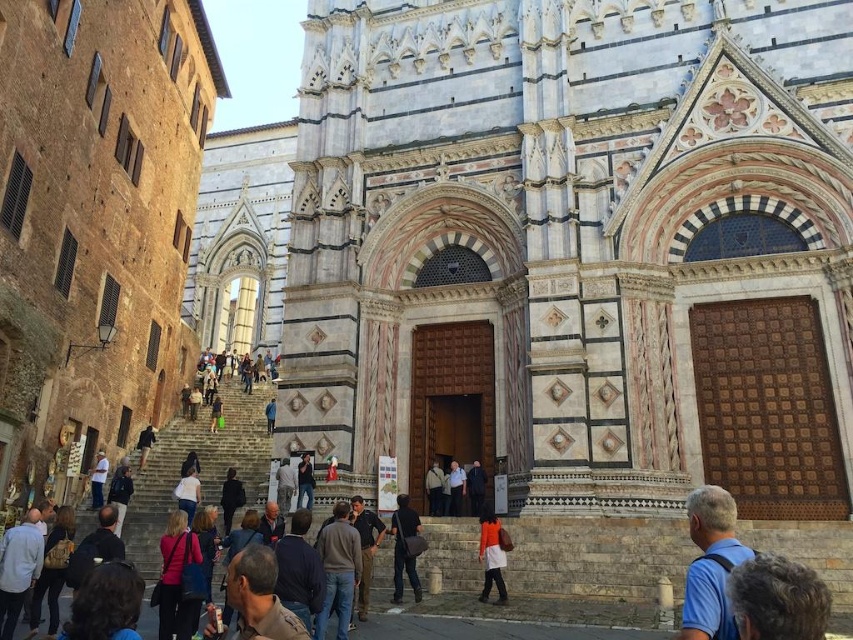
Who is lower down, gray stone stairs at center or brown leather jacket at center?

gray stone stairs at center

Which is more to the left, gray stone stairs at center or brown leather jacket at center?

From the viewer's perspective, gray stone stairs at center appears more on the left side.

At what (x,y) coordinates should I click in order to perform the action: click on gray stone stairs at center. Please return your answer as a coordinate pair (x, y). The width and height of the screenshot is (853, 640). Looking at the image, I should click on (200, 465).

Can you confirm if brown leather jacket at center is positioned above dark brown leather backpack at center?

Yes, brown leather jacket at center is above dark brown leather backpack at center.

Is point (337, 529) closer to camera compared to point (401, 518)?

Yes, point (337, 529) is in front of point (401, 518).

Find the location of `brown leather jacket at center`. brown leather jacket at center is located at coordinates (337, 570).

Consider the image. Does gray stone stairs at center have a greater height compared to light brown leather backpack at lower left?

Indeed, gray stone stairs at center has a greater height compared to light brown leather backpack at lower left.

Which of these two, gray stone stairs at center or light brown leather backpack at lower left, stands shorter?

Standing shorter between the two is light brown leather backpack at lower left.

Is point (175, 435) farther from viewer compared to point (51, 529)?

Yes, it is.

You are a GUI agent. You are given a task and a screenshot of the screen. Output one action in this format:
    pyautogui.click(x=<x>, y=<y>)
    Task: Click on the gray stone stairs at center
    The width and height of the screenshot is (853, 640).
    Given the screenshot: What is the action you would take?
    pyautogui.click(x=200, y=465)